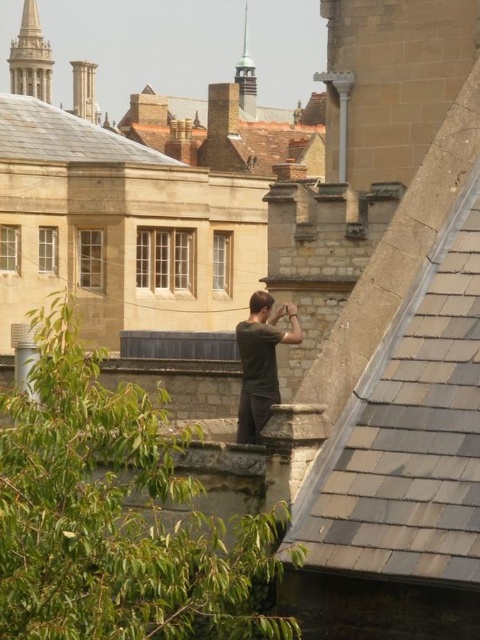
Can you confirm if polished stone spire at upper left is positioned below green patina spire at upper center?

No, polished stone spire at upper left is not below green patina spire at upper center.

Between polished stone spire at upper left and green patina spire at upper center, which one has more height?

Standing taller between the two is green patina spire at upper center.

Identify the location of polished stone spire at upper left. This screenshot has width=480, height=640. (31, 58).

Consider the image. Does brown tiled roof at upper left come in front of dark gray shirt at center?

No, brown tiled roof at upper left is further to the viewer.

Is point (70, 138) positioned after point (253, 394)?

Yes, it is behind point (253, 394).

Is point (167, 163) closer to camera compared to point (241, 324)?

That is False.

Find the location of `brown tiled roof at upper left`. brown tiled roof at upper left is located at coordinates (64, 136).

Measure the distance between point (20,138) and camera.

Point (20,138) and camera are 97.75 meters apart from each other.

Which is below, brown tiled roof at upper left or green patina spire at upper center?

brown tiled roof at upper left is lower down.

Measure the distance between brown tiled roof at upper left and camera.

brown tiled roof at upper left and camera are 91.84 meters apart from each other.

This screenshot has height=640, width=480. Find the location of `brown tiled roof at upper left`. brown tiled roof at upper left is located at coordinates (64, 136).